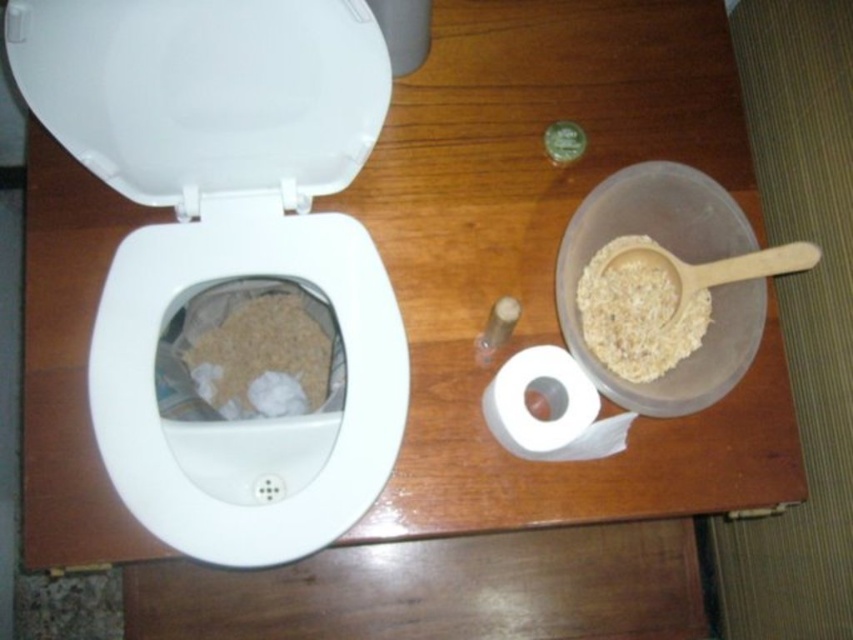
Looking at this image, you are a person sitting at the table and want to reach for either the white plastic toilet lid at upper left or the white matte toilet paper at lower right. Which object will you need to stretch your arm further to grab?

The white matte toilet paper at lower right is further away from you than the white plastic toilet lid at upper left, so you will need to stretch your arm further to grab the white matte toilet paper at lower right.

You are preparing to place a decorative item on the table. The white glossy toilet bowl at left is wider than the white matte toilet paper at lower right. Which object has a larger surface area for placing the item?

The white glossy toilet bowl at left has a larger surface area since its width surpasses that of the white matte toilet paper at lower right.